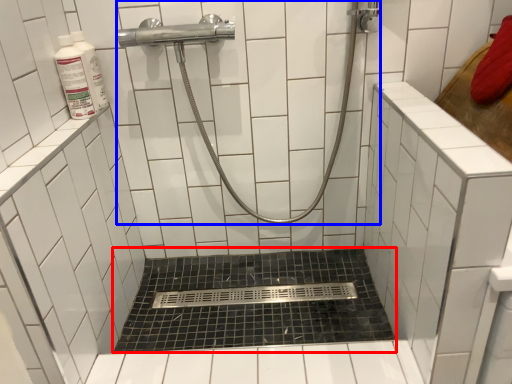
Question: Which object appears closest to the camera in this image, bath (highlighted by a red box) or shower (highlighted by a blue box)?

Choices:
 (A) bath
 (B) shower

Answer: (B)